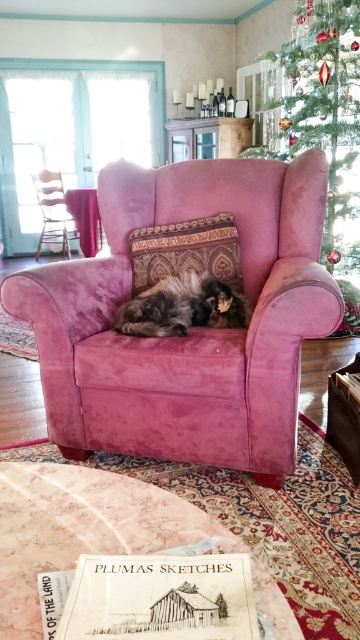
Between velvet pink armchair at center and wooden chair at left, which one has less height?

wooden chair at left is shorter.

Can you confirm if velvet pink armchair at center is positioned above wooden chair at left?

Incorrect, velvet pink armchair at center is not positioned above wooden chair at left.

The width and height of the screenshot is (360, 640). What do you see at coordinates (192, 330) in the screenshot?
I see `velvet pink armchair at center` at bounding box center [192, 330].

At what (x,y) coordinates should I click in order to perform the action: click on velvet pink armchair at center. Please return your answer as a coordinate pair (x, y). The height and width of the screenshot is (640, 360). Looking at the image, I should click on (192, 330).

Can you confirm if green velvet christmas tree at upper right is wider than wooden chair at left?

Yes, green velvet christmas tree at upper right is wider than wooden chair at left.

Between green velvet christmas tree at upper right and wooden chair at left, which one has less height?

wooden chair at left

Is point (327, 205) positioned in front of point (60, 220)?

That is True.

Where is `green velvet christmas tree at upper right`? green velvet christmas tree at upper right is located at coordinates (320, 109).

Which is in front, point (268, 232) or point (156, 284)?

Point (156, 284) is more forward.

Measure the distance between velvet pink armchair at center and fuzzy brown cat at center.

A distance of 8.69 inches exists between velvet pink armchair at center and fuzzy brown cat at center.

Locate an element on the screen. The image size is (360, 640). velvet pink armchair at center is located at coordinates (192, 330).